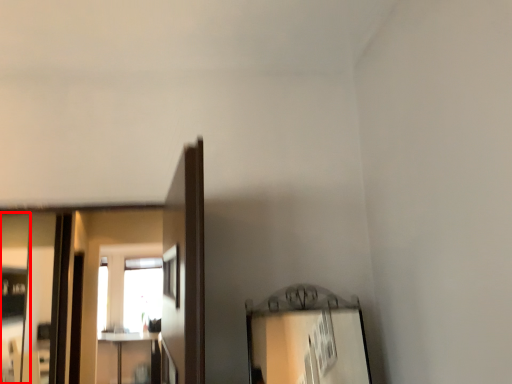
Question: From the image's perspective, considering the relative positions of mirror (annotated by the red box) and mirror in the image provided, where is mirror (annotated by the red box) located with respect to the staircase?

Choices:
 (A) below
 (B) above

Answer: (B)